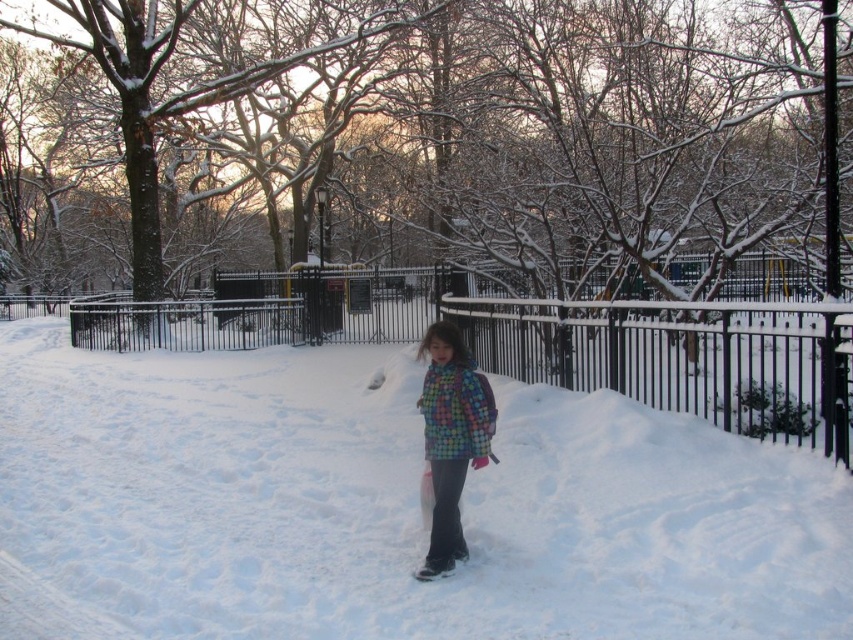
You are a winter explorer standing in the park and see the white fluffy snow at center and the black metal fence at center. Which object is positioned to the right of the other?

The white fluffy snow at center is to the right of the black metal fence at center.

You are a photographer wanting to capture the multicolored quilted jacket at center against the white fluffy snow at center. Considering their sizes, which object will dominate the frame if you focus on the jacket?

The white fluffy snow at center is larger in size than the multicolored quilted jacket at center, so if you focus on the jacket, the snow will still dominate the frame due to its larger size.